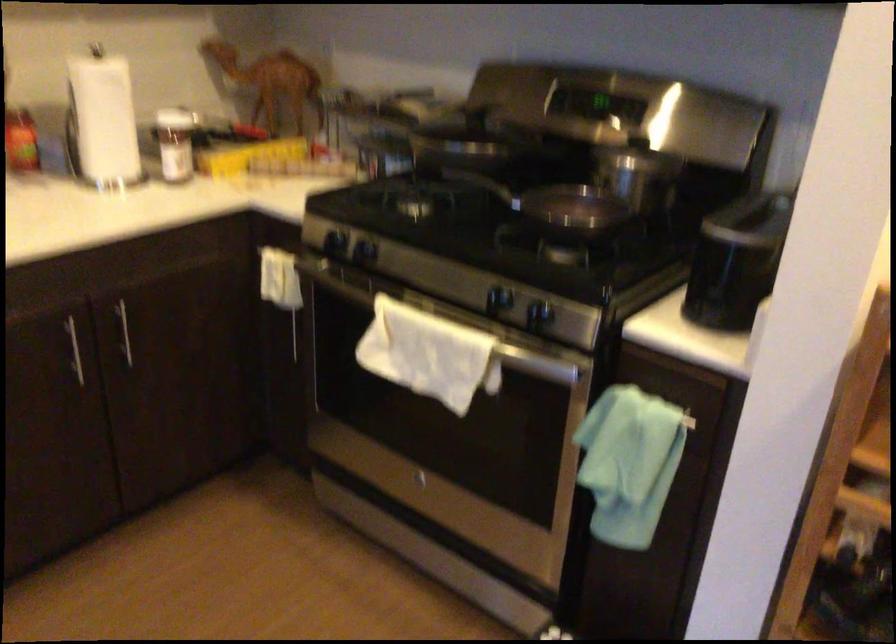
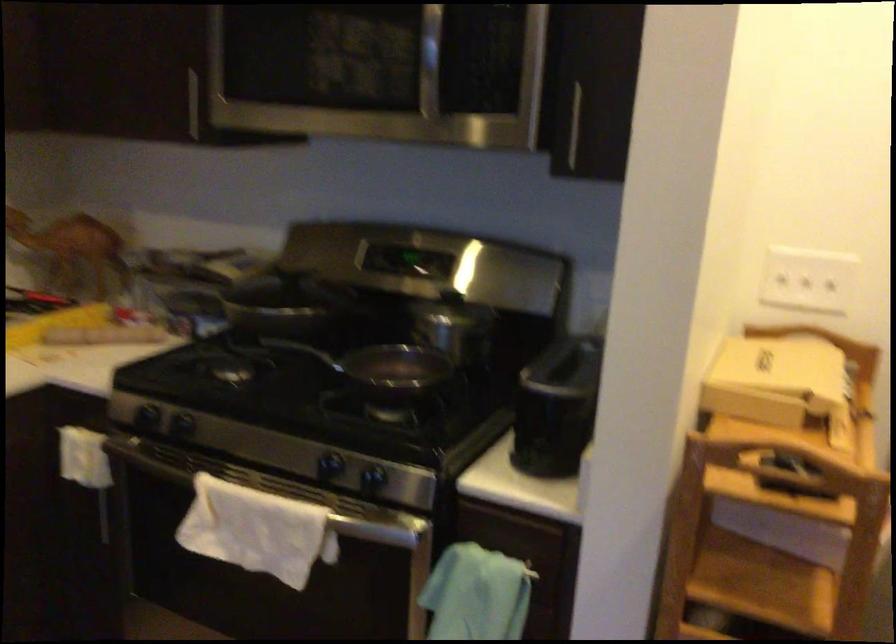
Question: Which direction would the cameraman need to move to produce the second image? Reply with the corresponding letter.

Choices:
 (A) Left
 (B) Right
 (C) Forward
 (D) Backward

Answer: (B)